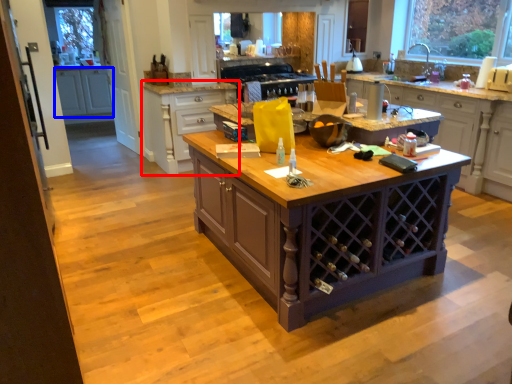
Question: Which object appears closest to the camera in this image, cabinetry (highlighted by a red box) or cabinetry (highlighted by a blue box)?

Choices:
 (A) cabinetry
 (B) cabinetry

Answer: (A)